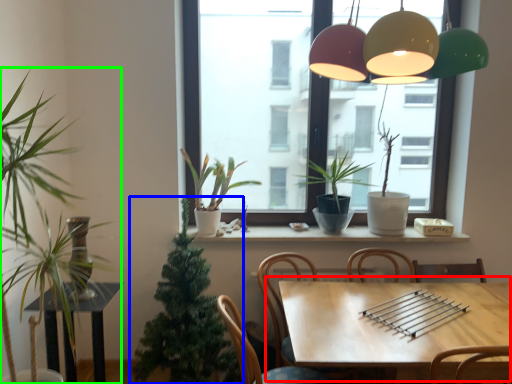
Question: Which is nearer to the table (highlighted by a red box)? houseplant (highlighted by a blue box) or houseplant (highlighted by a green box).

Choices:
 (A) houseplant
 (B) houseplant

Answer: (A)